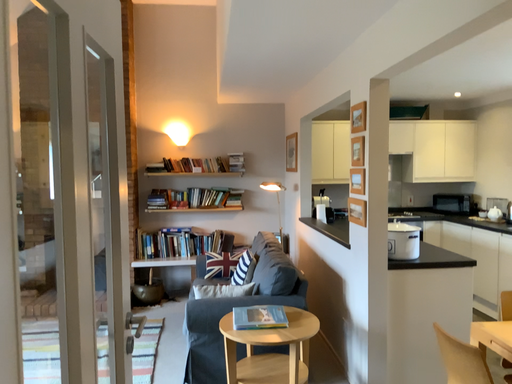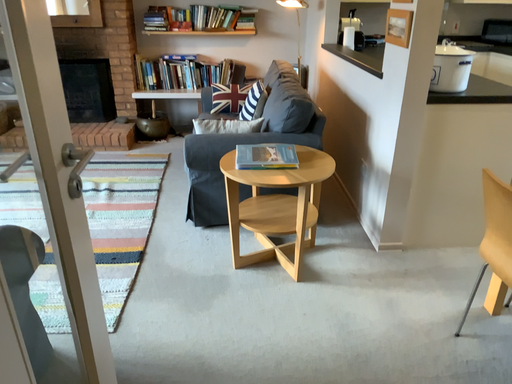
Question: Which way did the camera rotate in the video?

Choices:
 (A) rotated upward
 (B) rotated downward

Answer: (B)